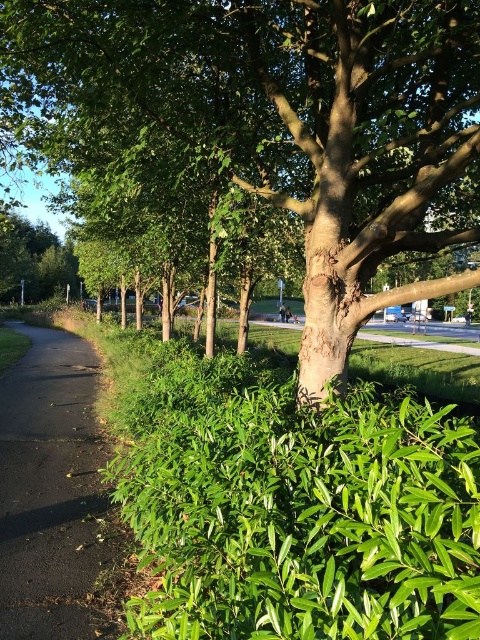
Question: Can you confirm if green bark tree at center is wider than black asphalt path at left?

Choices:
 (A) no
 (B) yes

Answer: (A)

Question: Is green bark tree at center positioned before black asphalt path at left?

Choices:
 (A) yes
 (B) no

Answer: (B)

Question: Which object is closer to the camera taking this photo?

Choices:
 (A) black asphalt path at left
 (B) green bark tree at center

Answer: (A)

Question: Which object is closer to the camera taking this photo?

Choices:
 (A) black asphalt path at left
 (B) green bark tree at center

Answer: (A)

Question: Observing the image, what is the correct spatial positioning of green bark tree at center in reference to black asphalt path at left?

Choices:
 (A) above
 (B) below

Answer: (A)

Question: Which point is farther to the camera?

Choices:
 (A) green bark tree at center
 (B) black asphalt path at left

Answer: (A)